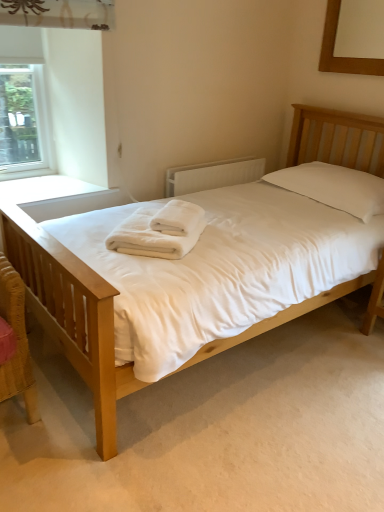
Question: Could you tell me if white soft towel at center, which appears as the second bath towel when viewed from the top, is facing clear glass window at upper left?

Choices:
 (A) yes
 (B) no

Answer: (B)

Question: From a real-world perspective, is white soft towel at center, which ranks as the first bath towel in bottom-to-top order, positioned under clear glass window at upper left based on gravity?

Choices:
 (A) no
 (B) yes

Answer: (B)

Question: Is clear glass window at upper left located within white soft towel at center, which appears as the second bath towel when viewed from the top?

Choices:
 (A) yes
 (B) no

Answer: (B)

Question: Is white soft towel at center, which appears as the second bath towel when viewed from the top, located outside clear glass window at upper left?

Choices:
 (A) yes
 (B) no

Answer: (A)

Question: Can you confirm if white soft towel at center, which appears as the second bath towel when viewed from the top, is taller than clear glass window at upper left?

Choices:
 (A) yes
 (B) no

Answer: (B)

Question: Based on their sizes in the image, would you say light wood bed at center is bigger or smaller than wooden picture frame at upper right?

Choices:
 (A) big
 (B) small

Answer: (A)

Question: Considering their positions, is light wood bed at center located in front of or behind wooden picture frame at upper right?

Choices:
 (A) front
 (B) behind

Answer: (A)

Question: From the image's perspective, is light wood bed at center positioned above or below wooden picture frame at upper right?

Choices:
 (A) above
 (B) below

Answer: (B)

Question: Considering the positions of light wood bed at center and wooden picture frame at upper right in the image, is light wood bed at center wider or thinner than wooden picture frame at upper right?

Choices:
 (A) thin
 (B) wide

Answer: (B)

Question: Is white soft towel at center, which ranks as the first bath towel in bottom-to-top order, inside or outside of light wood bed at center?

Choices:
 (A) inside
 (B) outside

Answer: (A)

Question: From their relative heights in the image, would you say white soft towel at center, which ranks as the first bath towel in bottom-to-top order, is taller or shorter than light wood bed at center?

Choices:
 (A) short
 (B) tall

Answer: (A)

Question: Would you say white soft towel at center, which ranks as the first bath towel in bottom-to-top order, is to the left or to the right of light wood bed at center in the picture?

Choices:
 (A) right
 (B) left

Answer: (B)

Question: In the image, is white soft towel at center, which appears as the second bath towel when viewed from the top, positioned in front of or behind light wood bed at center?

Choices:
 (A) behind
 (B) front

Answer: (A)

Question: Choose the correct answer: Is white soft towel at center, placed as the second bath towel when sorted from bottom to top, inside wooden picture frame at upper right or outside it?

Choices:
 (A) outside
 (B) inside

Answer: (A)

Question: Considering the positions of point (178, 217) and point (354, 61), is point (178, 217) closer or farther from the camera than point (354, 61)?

Choices:
 (A) closer
 (B) farther

Answer: (A)